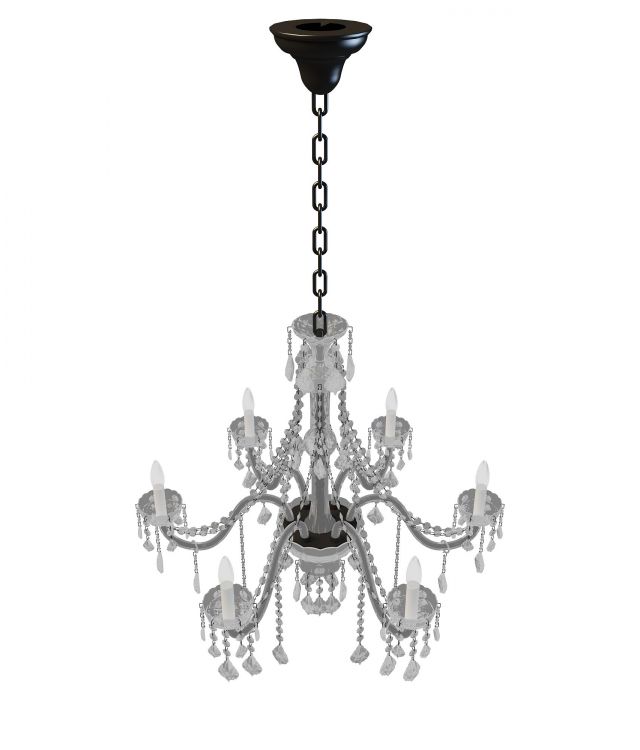
You are a GUI agent. You are given a task and a screenshot of the screen. Output one action in this format:
    pyautogui.click(x=<x>, y=<y>)
    Task: Click on the top hanging crystals
    This screenshot has width=640, height=750.
    Given the screenshot: What is the action you would take?
    click(289, 363), click(308, 380), click(337, 386), click(351, 364)